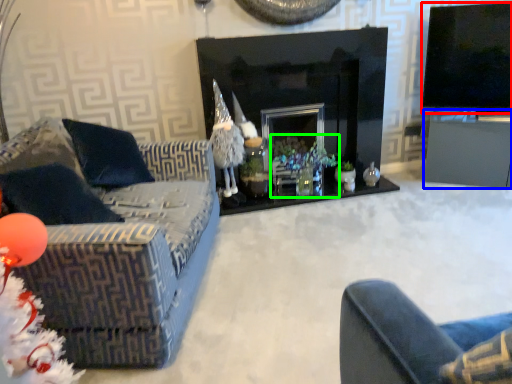
Question: Which is farther away from television (highlighted by a red box)? table (highlighted by a blue box) or christmas decoration (highlighted by a green box)?

Choices:
 (A) table
 (B) christmas decoration

Answer: (B)